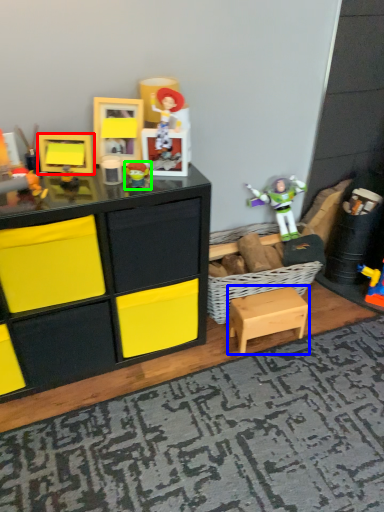
Question: Which object is positioned closest to toy (highlighted by a red box)? Select from table (highlighted by a blue box) and toy (highlighted by a green box).

Choices:
 (A) table
 (B) toy

Answer: (B)